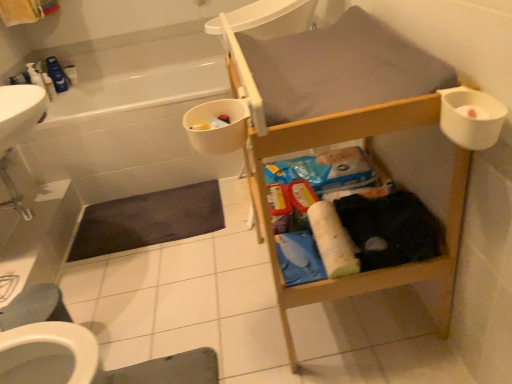
At what (x,y) coordinates should I click in order to perform the action: click on free space to the right of white plastic bidet at lower left. Please return your answer as a coordinate pair (x, y). Looking at the image, I should click on (120, 329).